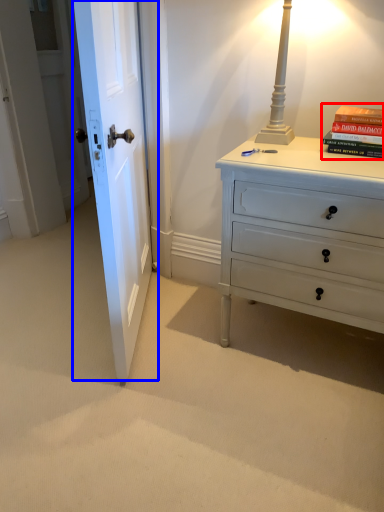
Question: Which point is closer to the camera, paperback book (highlighted by a red box) or door (highlighted by a blue box)?

Choices:
 (A) paperback book
 (B) door

Answer: (B)